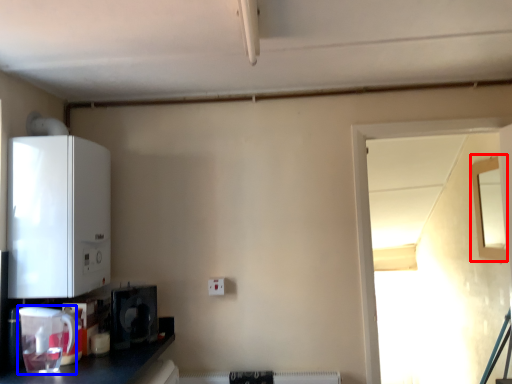
Question: Which object appears closest to the camera in this image, window (highlighted by a red box) or appliance (highlighted by a blue box)?

Choices:
 (A) window
 (B) appliance

Answer: (B)